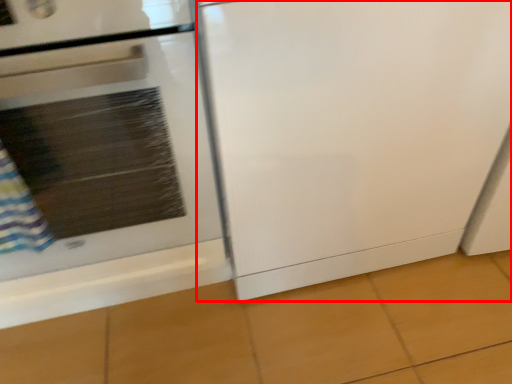
Question: From the image's perspective, what is the correct spatial positioning of screen door (annotated by the red box) in reference to home appliance?

Choices:
 (A) above
 (B) below

Answer: (A)